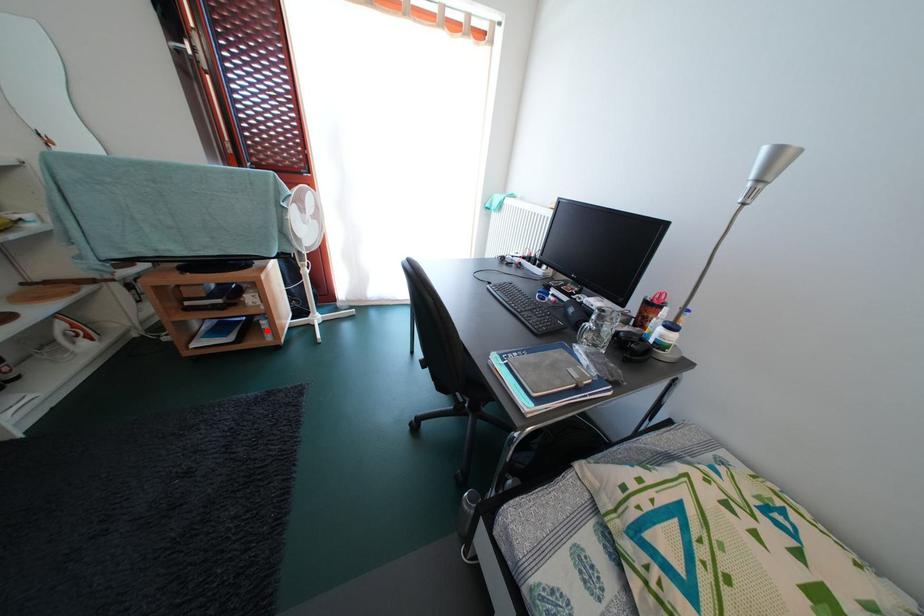
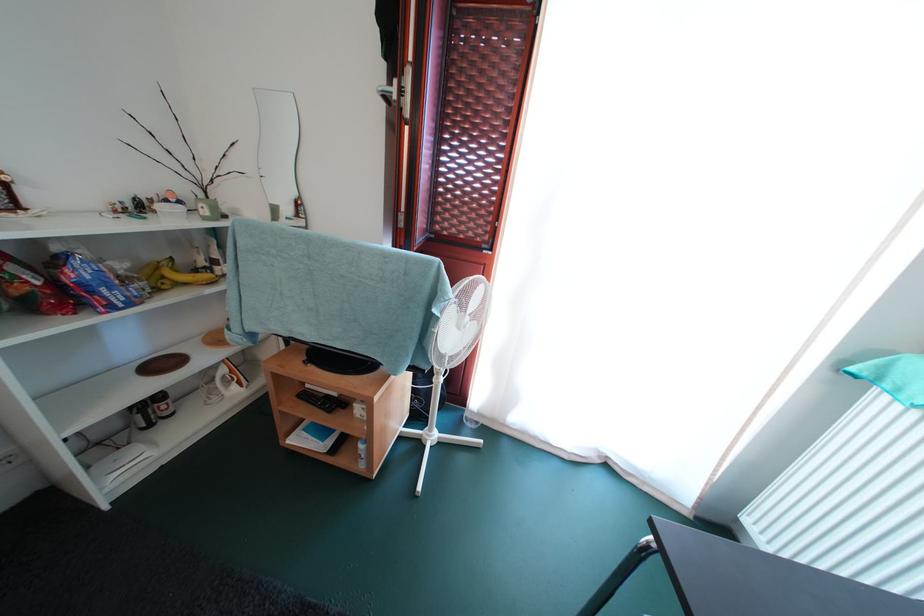
Question: I am providing you with two images of the same scene from different viewpoints. Image1 has a red point marked. In image2, the corresponding 3D location appears at what relative position? Reply with the corresponding letter.

Choices:
 (A) Closer
 (B) Farther

Answer: (B)